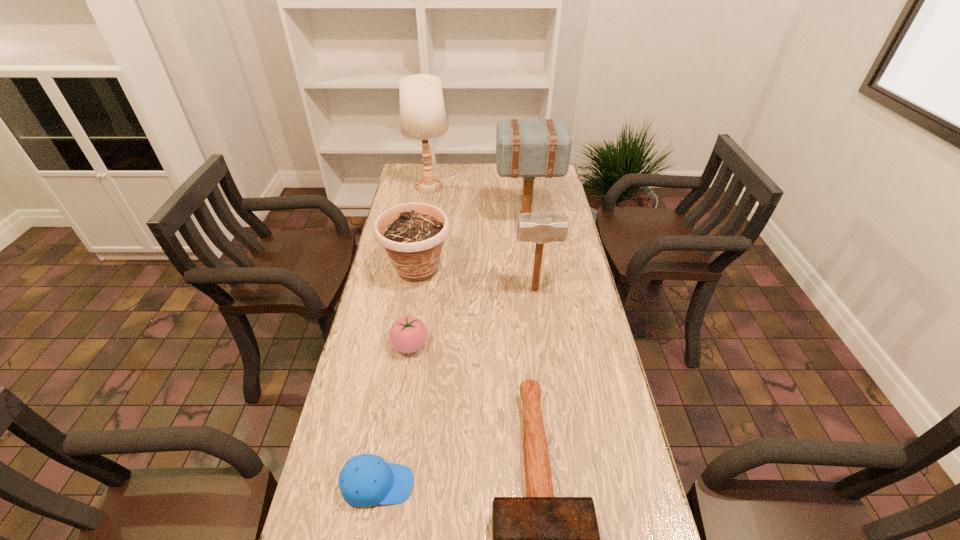
Where is `object that is at the far edge`? object that is at the far edge is located at coordinates (422, 113).

Find the location of a particular element. Image resolution: width=960 pixels, height=540 pixels. lamp situated at the left edge is located at coordinates (422, 113).

Locate an element on the screen. flowerpot positioned at the left edge is located at coordinates (413, 234).

The height and width of the screenshot is (540, 960). Identify the location of tomato that is at the left edge. (408, 334).

Where is `cap that is at the left edge`? cap that is at the left edge is located at coordinates (365, 480).

Image resolution: width=960 pixels, height=540 pixels. In order to click on object present at the far left corner in this screenshot , I will do `click(422, 113)`.

Identify the location of vacant space at the far edge of the desktop. Image resolution: width=960 pixels, height=540 pixels. (478, 187).

Locate an element on the screen. vacant point at the left edge is located at coordinates (387, 288).

Locate an element on the screen. The width and height of the screenshot is (960, 540). free region at the right edge of the desktop is located at coordinates (538, 197).

Where is `vacant space at the far right corner`? vacant space at the far right corner is located at coordinates (547, 184).